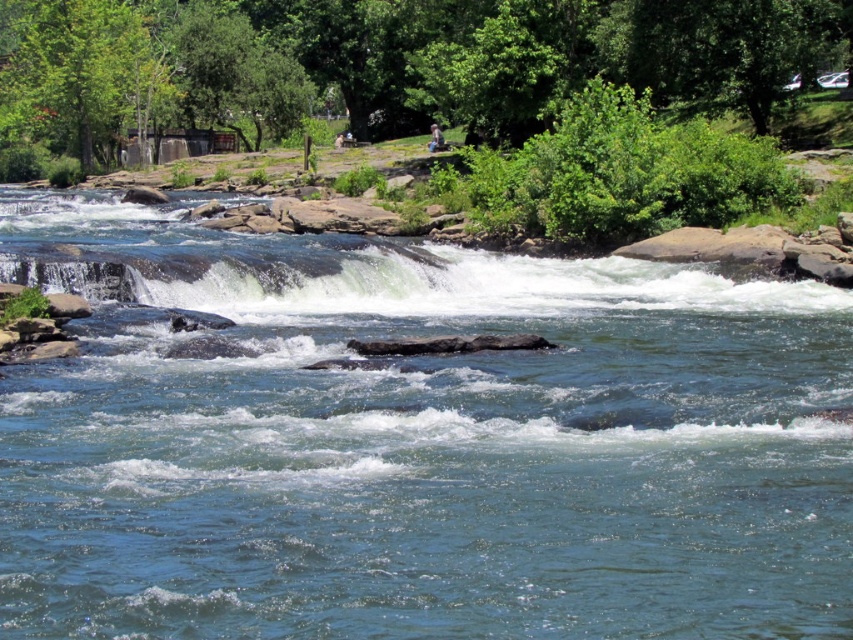
You are standing at the point labeled point (x=171, y=74) and want to reach the point labeled point (x=239, y=240). Based on the scene description, which direction should you move to get there?

You should move forward because point (x=239, y=240) is in front of point (x=171, y=74).

You are standing at the edge of the river and want to throw a stone into the clear blue water at center. Considering the distance between you and the water, can you estimate if a typical adult can accurately throw a stone that far?

The distance between you and the clear blue water at center is 11.45 meters. A typical adult can throw a stone about 15 to 20 meters, so it is possible but may require some effort and skill.

You are a photographer planning to take a photo of the clear blue water at center and the green leafy tree at upper center. Since the tree is casting a shadow, will the water be in the shadow area? Please explain based on their positions.

The clear blue water at center is positioned under the green leafy tree at upper center. Since the tree is casting a shadow, the water would be in the shadow area if the sun is positioned such that the tree blocks sunlight from reaching the water. However, the scene description mentions bright lighting and shadows cast by the trees, so it depends on the sun angle. If the tree is directly overhead or the sun is behind the photographer, the shadow might fall on the water.